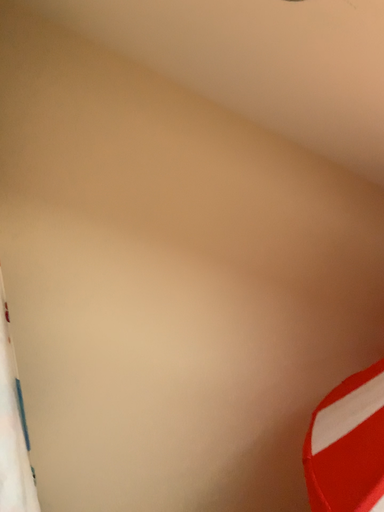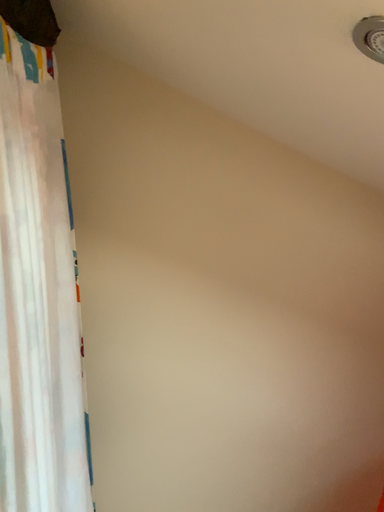
Question: Which way did the camera rotate in the video?

Choices:
 (A) rotated right
 (B) rotated left

Answer: (B)